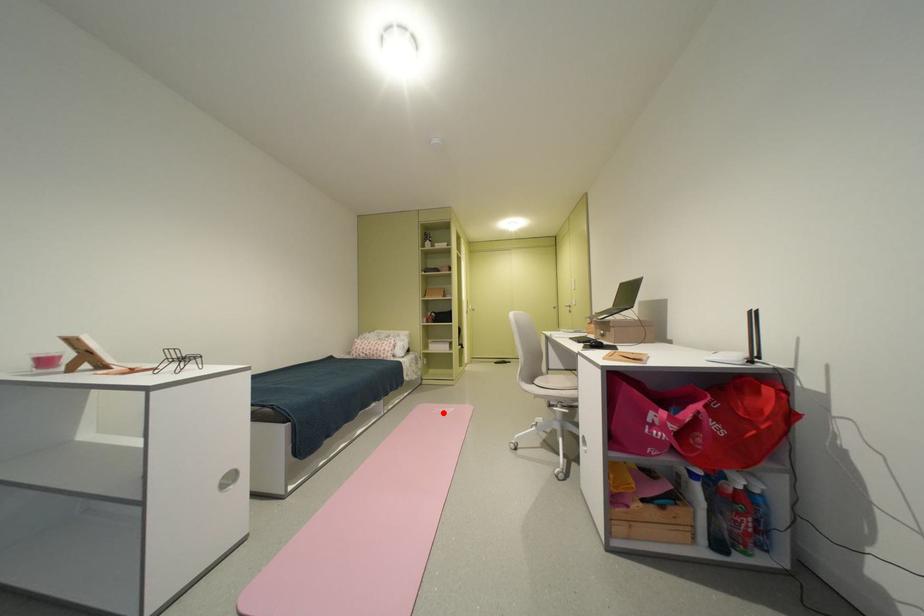
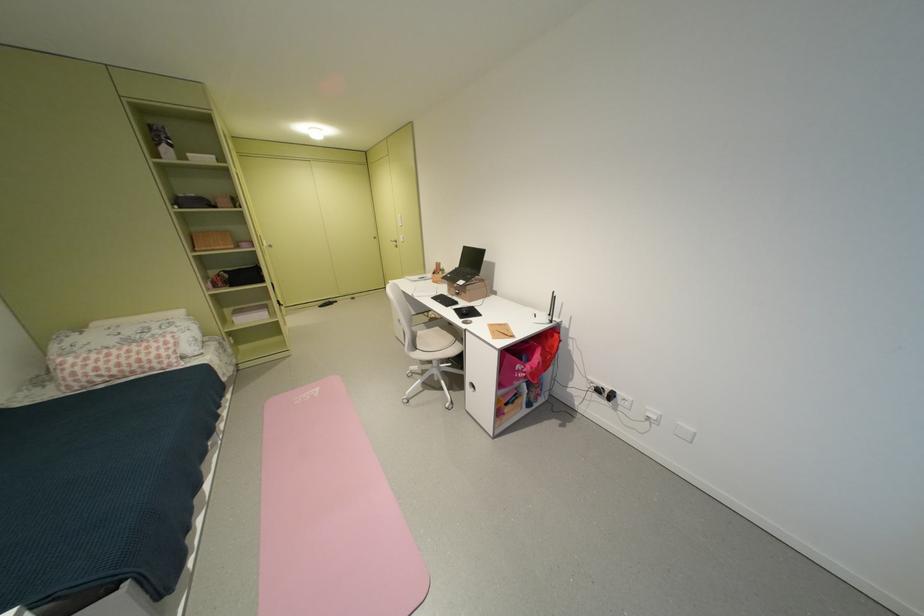
Question: I am providing you with two images of the same scene from different viewpoints. In image1, a red point is highlighted. Considering the same 3D point in image2, which of the following is correct?

Choices:
 (A) It is closer
 (B) It is farther

Answer: (A)